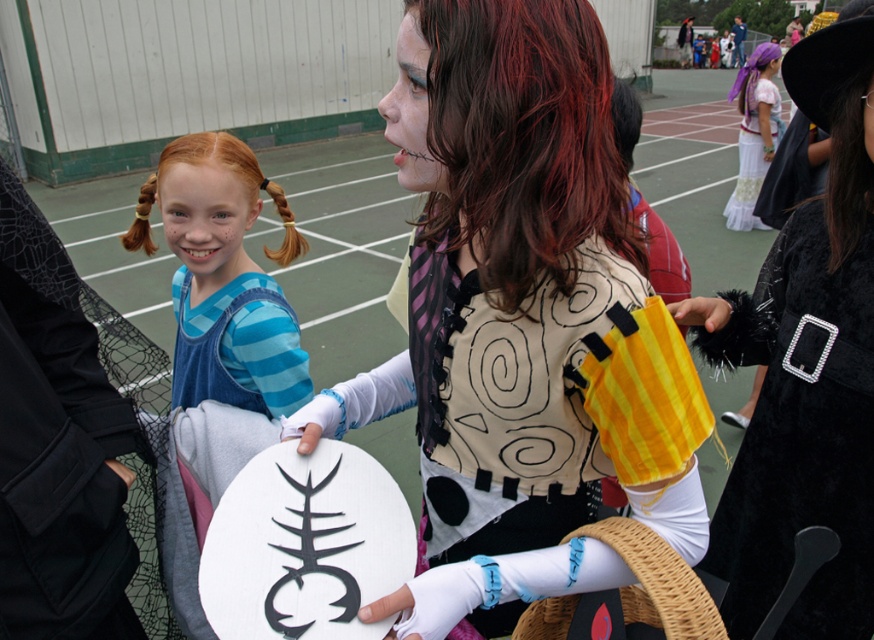
Question: Which of these objects is positioned closest to the white cotton dress at upper right?

Choices:
 (A) blue striped shirt at center
 (B) velvet black cape at right

Answer: (B)

Question: Which of the following is the farthest from the observer?

Choices:
 (A) blue striped shirt at center
 (B) velvet black cape at right

Answer: (A)

Question: Does matte black vest at center appear on the right side of white cotton dress at upper right?

Choices:
 (A) yes
 (B) no

Answer: (B)

Question: Which point is closer to the camera?

Choices:
 (A) (801, 364)
 (B) (193, 182)

Answer: (A)

Question: Can you confirm if matte black vest at center is smaller than blue striped shirt at center?

Choices:
 (A) yes
 (B) no

Answer: (B)

Question: Does blue striped shirt at center have a greater width compared to white cotton dress at upper right?

Choices:
 (A) yes
 (B) no

Answer: (B)